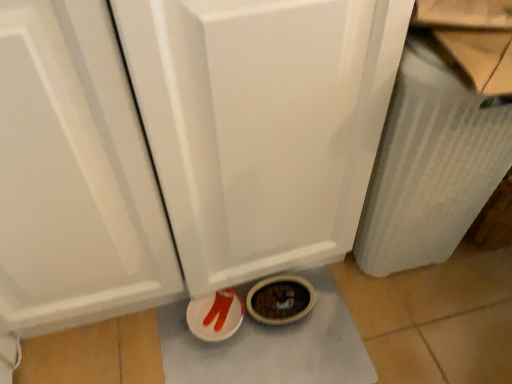
Question: From the image's perspective, is white textured bath mat at lower center over white textured radiator at right?

Choices:
 (A) no
 (B) yes

Answer: (A)

Question: Considering the relative sizes of white textured bath mat at lower center and white textured radiator at right in the image provided, is white textured bath mat at lower center shorter than white textured radiator at right?

Choices:
 (A) yes
 (B) no

Answer: (A)

Question: Can you confirm if white textured bath mat at lower center is bigger than white textured radiator at right?

Choices:
 (A) yes
 (B) no

Answer: (B)

Question: Is white textured bath mat at lower center taller than white textured radiator at right?

Choices:
 (A) no
 (B) yes

Answer: (A)

Question: Is white textured bath mat at lower center turned away from white textured radiator at right?

Choices:
 (A) no
 (B) yes

Answer: (A)

Question: In the image, is matte plastic shoes at lower center positioned in front of or behind white textured radiator at right?

Choices:
 (A) front
 (B) behind

Answer: (B)

Question: From the image's perspective, is matte plastic shoes at lower center located above or below white textured radiator at right?

Choices:
 (A) below
 (B) above

Answer: (A)

Question: From a real-world perspective, is matte plastic shoes at lower center above or below white textured radiator at right?

Choices:
 (A) above
 (B) below

Answer: (B)

Question: Would you say matte plastic shoes at lower center is inside or outside white textured radiator at right?

Choices:
 (A) outside
 (B) inside

Answer: (A)

Question: From a real-world perspective, is white textured radiator at right positioned above or below white textured bath mat at lower center?

Choices:
 (A) below
 (B) above

Answer: (B)

Question: Is point (391, 243) closer or farther from the camera than point (238, 367)?

Choices:
 (A) closer
 (B) farther

Answer: (B)

Question: From the image's perspective, is white textured radiator at right located above or below white textured bath mat at lower center?

Choices:
 (A) below
 (B) above

Answer: (B)

Question: Considering the positions of white textured radiator at right and white textured bath mat at lower center in the image, is white textured radiator at right bigger or smaller than white textured bath mat at lower center?

Choices:
 (A) big
 (B) small

Answer: (A)

Question: Considering the positions of white textured bath mat at lower center and matte plastic shoes at lower center in the image, is white textured bath mat at lower center wider or thinner than matte plastic shoes at lower center?

Choices:
 (A) wide
 (B) thin

Answer: (A)

Question: From a real-world perspective, is white textured bath mat at lower center above or below matte plastic shoes at lower center?

Choices:
 (A) above
 (B) below

Answer: (B)